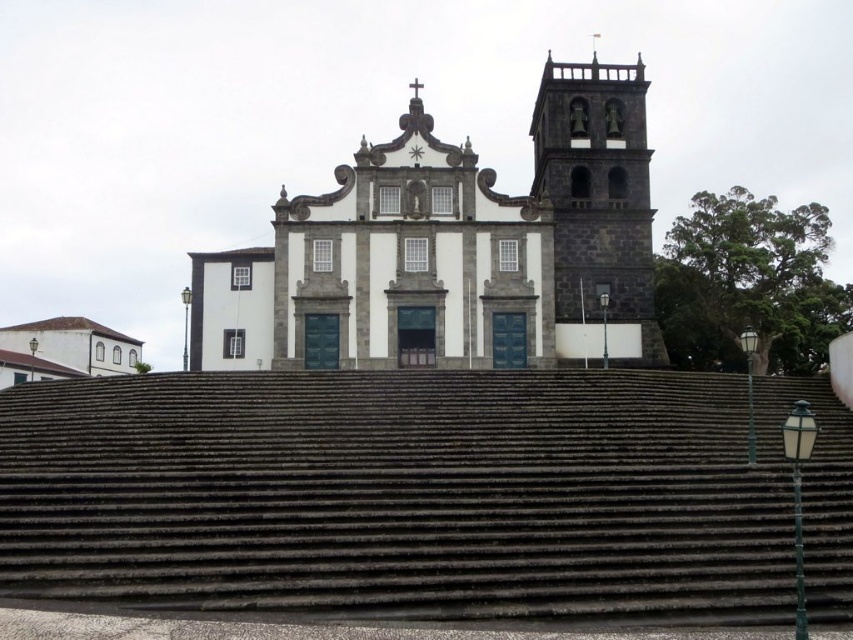
You are standing at a point 88.50 meters away from the camera position. You want to take a photo of the church while ensuring that the point at coordinates point (469, 253) is clearly visible in the frame. Given that your camera has a focal length of 50mm and a sensor size of 24mm x 36mm, what is the minimum distance you should maintain from the church to ensure the point remains in the frame?

The point at coordinates point (469, 253) is located 88.50 meters away from the camera. To ensure it stays in the frame, you should position yourself at least 88.50 meters away from the church.

You are standing at the entrance of the grand church and want to reach the dark gray stone bell tower at upper right. Which direction should you walk to get there from the dark gray stone stairs at center?

You should walk towards the upper right direction from the dark gray stone stairs at center because the dark gray stone bell tower at upper right is located behind it, meaning you need to move away from the entrance towards the upper right to reach it.

You are standing at the entrance of the grand church and want to take a photo of the bell tower. The camera you are using has a maximum focus range of 60 meters. Will the point at coordinates point (287, 586) be in focus?

The point at coordinates point (287, 586) is 65.56 meters away from the camera. Since the camera can only focus up to 60 meters, the point will be out of focus.